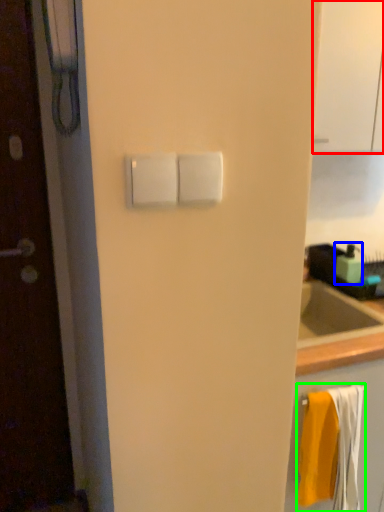
Question: Which is nearer to the glass door (highlighted by a red box)? soap dispenser (highlighted by a blue box) or bath towel (highlighted by a green box).

Choices:
 (A) soap dispenser
 (B) bath towel

Answer: (A)